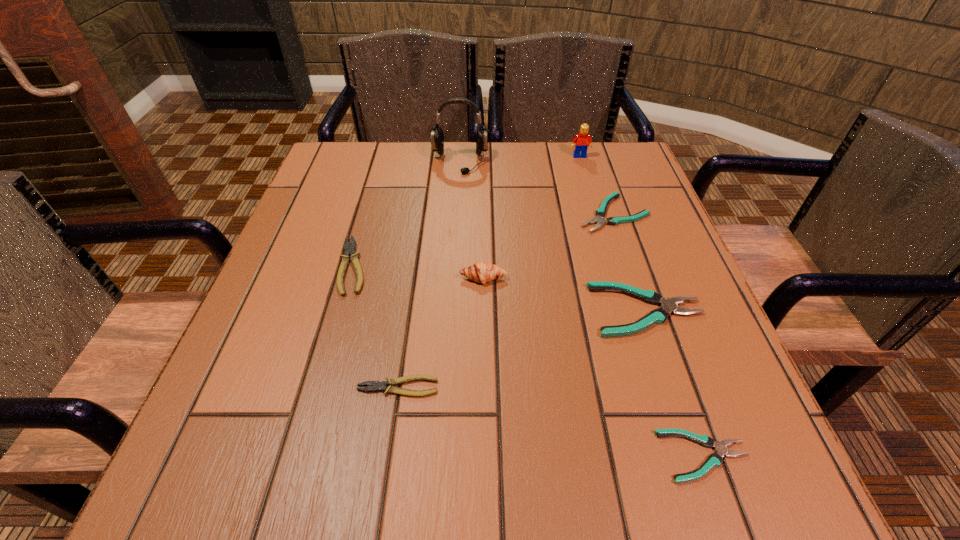
Identify which teal pliers is located as the nearest to the biggest teal pliers. Please provide its 2D coordinates. Your answer should be formatted as a tuple, i.e. [(x, y)], where the tuple contains the x and y coordinates of a point satisfying the conditions above.

[(600, 213)]

You are a GUI agent. You are given a task and a screenshot of the screen. Output one action in this format:
    pyautogui.click(x=<x>, y=<y>)
    Task: Click on the vacant area in the image that satisfies the following two spatial constraints: 1. on the front-facing side of the second nearest teal pliers; 2. on the right side of the Lego
    This screenshot has width=960, height=540.
    Given the screenshot: What is the action you would take?
    pyautogui.click(x=625, y=310)

The height and width of the screenshot is (540, 960). I want to click on vacant point that satisfies the following two spatial constraints: 1. with the microphone on the side of the biggest teal pliers; 2. on the right side of the tallest object, so click(451, 310).

Find the location of a particular element. This screenshot has width=960, height=540. vacant space that satisfies the following two spatial constraints: 1. with the microphone on the side of the tallest object; 2. on the right side of the second farthest teal pliers is located at coordinates (451, 310).

Find the location of a particular element. The width and height of the screenshot is (960, 540). vacant space that satisfies the following two spatial constraints: 1. with the microphone on the side of the sixth nearest object; 2. on the left side of the headset is located at coordinates (457, 213).